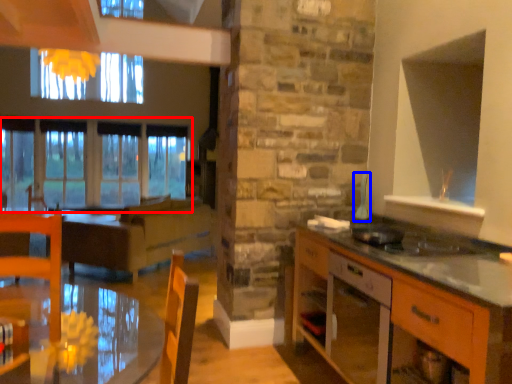
Question: Which point is further to the camera, window (highlighted by a red box) or appliance (highlighted by a blue box)?

Choices:
 (A) window
 (B) appliance

Answer: (A)